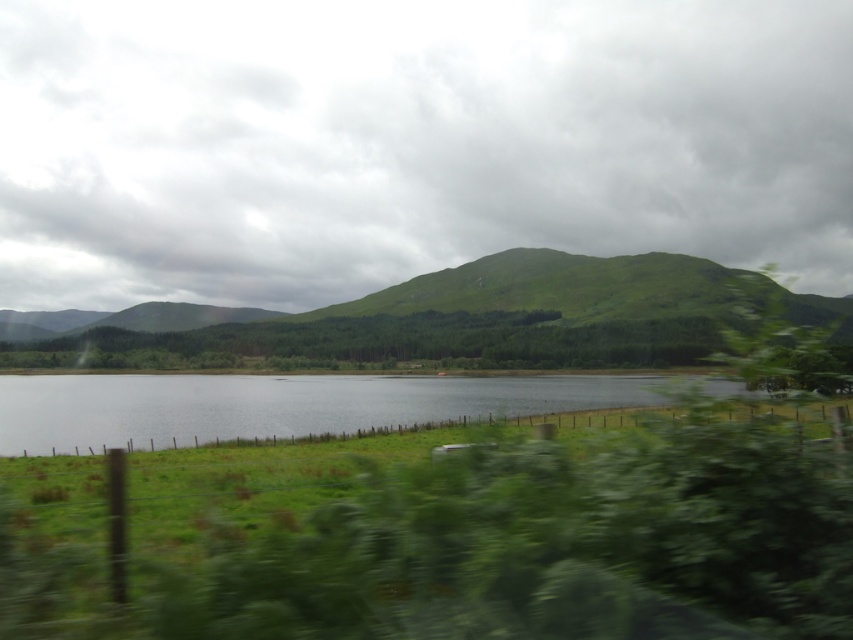
Question: Can you confirm if green grassy hill at center is positioned above clear water at center?

Choices:
 (A) no
 (B) yes

Answer: (B)

Question: Can you confirm if green grassy hill at center is wider than clear water at center?

Choices:
 (A) no
 (B) yes

Answer: (B)

Question: Does green grassy hill at center have a greater width compared to clear water at center?

Choices:
 (A) no
 (B) yes

Answer: (B)

Question: Which object is farther from the camera taking this photo?

Choices:
 (A) clear water at center
 (B) green grassy hill at center

Answer: (A)

Question: Which point appears closest to the camera in this image?

Choices:
 (A) (514, 381)
 (B) (184, 324)

Answer: (A)